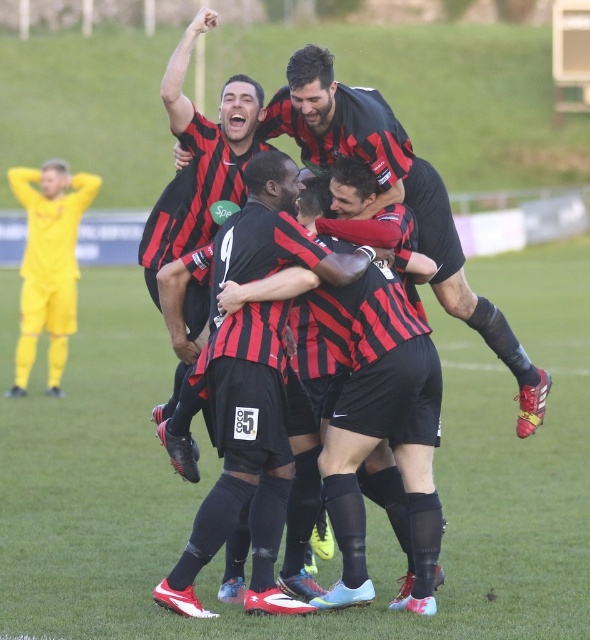
You are a drone operator trying to capture a wide shot of the soccer field. The green grass at center and the matte black soccer players at center are both in your camera frame. According to the scene, which object is wider in the image?

The green grass at center is wider than the matte black soccer players at center.